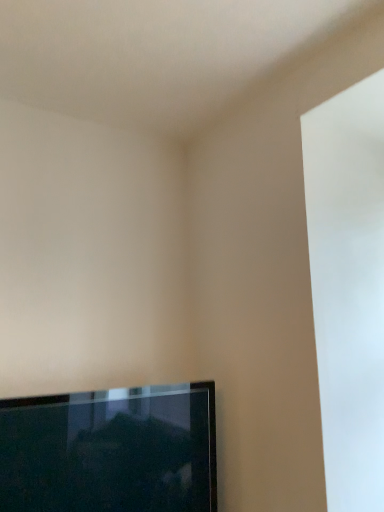
What do you see at coordinates (110, 451) in the screenshot?
I see `black glossy tv at lower left` at bounding box center [110, 451].

What is the approximate width of black glossy tv at lower left?

The width of black glossy tv at lower left is 6.80 inches.

At what (x,y) coordinates should I click in order to perform the action: click on black glossy tv at lower left. Please return your answer as a coordinate pair (x, y). The image size is (384, 512). Looking at the image, I should click on (110, 451).

Locate an element on the screen. The height and width of the screenshot is (512, 384). black glossy tv at lower left is located at coordinates (110, 451).